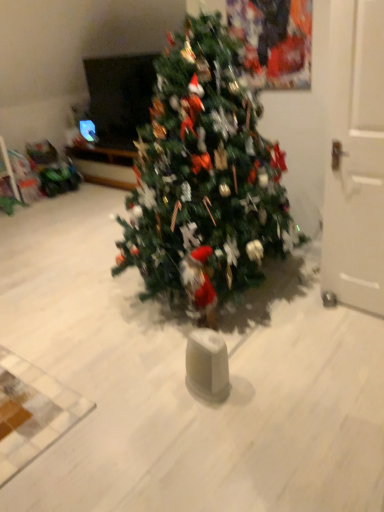
What are the coordinates of `free space on the front side of green matte christmas tree at center` in the screenshot? It's located at (209, 401).